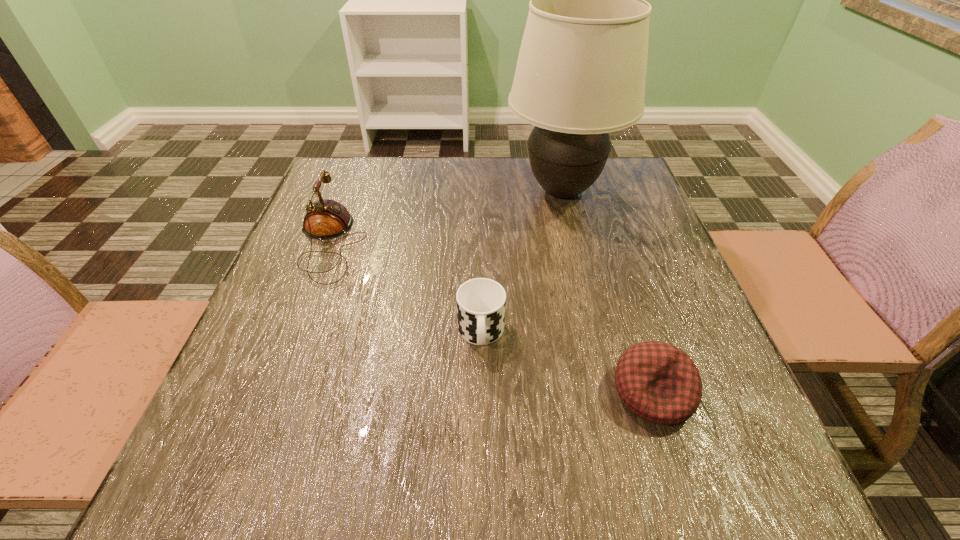
Identify the location of empty space between the lampshade and the beanbag. (608, 292).

The image size is (960, 540). In order to click on vacant space in between the telephone and the tallest object in this screenshot , I will do `click(446, 217)`.

The height and width of the screenshot is (540, 960). In order to click on vacant region between the second object from left to right and the leftmost object in this screenshot , I will do `click(406, 288)`.

In order to click on vacant point located between the beanbag and the lampshade in this screenshot , I will do `click(608, 292)`.

This screenshot has height=540, width=960. What are the coordinates of `blank region between the cup and the lampshade` in the screenshot? It's located at (521, 262).

Locate an element on the screen. vacant space that's between the lampshade and the beanbag is located at coordinates (608, 292).

Identify the location of vacant space in between the lampshade and the telephone. The height and width of the screenshot is (540, 960). (446, 217).

At what (x,y) coordinates should I click in order to perform the action: click on object that is the closest to the cup. Please return your answer as a coordinate pair (x, y). Image resolution: width=960 pixels, height=540 pixels. Looking at the image, I should click on (658, 382).

The width and height of the screenshot is (960, 540). Find the location of `object that can be found as the closest to the lampshade`. object that can be found as the closest to the lampshade is located at coordinates (481, 302).

I want to click on free point that satisfies the following two spatial constraints: 1. on the side of the beanbag with the handle; 2. on the left side of the cup, so click(481, 393).